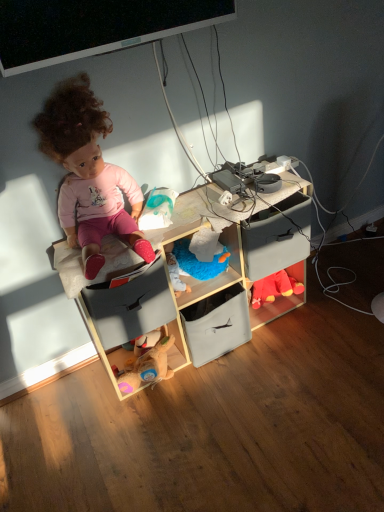
Find the location of a particular element. The height and width of the screenshot is (512, 384). free space in front of soft fabric storage at center, marked as the first shelf in a right-to-left arrangement is located at coordinates (225, 388).